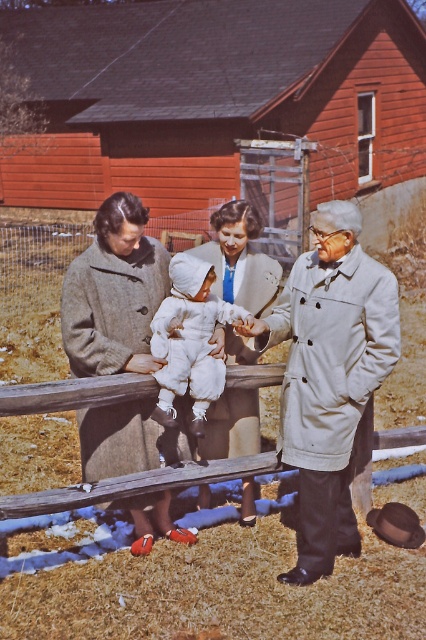
Is white woolen suit at center smaller than cozy wool coat at center?

Actually, white woolen suit at center might be larger than cozy wool coat at center.

Does white woolen suit at center appear on the left side of cozy wool coat at center?

No, white woolen suit at center is not to the left of cozy wool coat at center.

Locate an element on the screen. white woolen suit at center is located at coordinates (328, 376).

At what (x,y) coordinates should I click in order to perform the action: click on white wool coat at center. Please return your answer as a coordinate pair (x, y). This screenshot has height=640, width=426. Looking at the image, I should click on (239, 259).

What do you see at coordinates (239, 259) in the screenshot? I see `white wool coat at center` at bounding box center [239, 259].

Find the location of `white wool coat at center`. white wool coat at center is located at coordinates (239, 259).

Does point (316, 381) come farther from viewer compared to point (117, 467)?

No, it is in front of (117, 467).

Which is in front, point (348, 353) or point (131, 250)?

Positioned in front is point (348, 353).

Who is more distant from viewer, (322,349) or (155,442)?

The point (155,442) is more distant.

This screenshot has width=426, height=640. In order to click on light beige trench coat at center in this screenshot , I will do `click(328, 376)`.